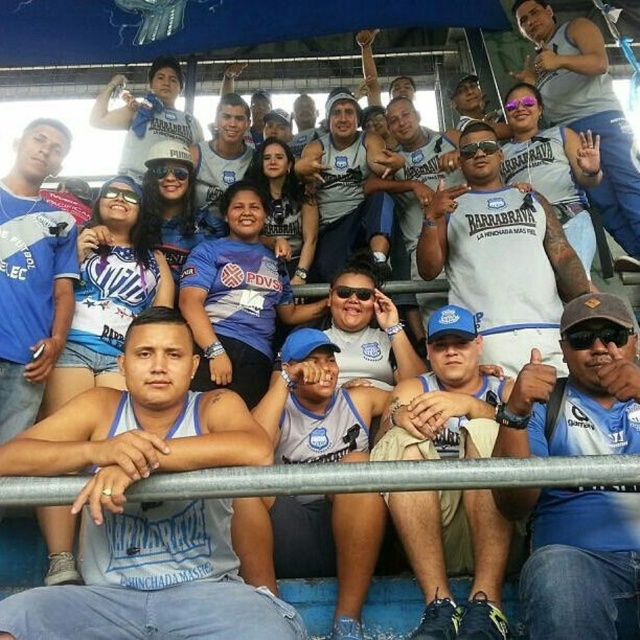
In the scene shown: Is blue jersey at center shorter than matte blue shirt at upper center?

Yes, blue jersey at center is shorter than matte blue shirt at upper center.

Based on the photo, which is more to the right, blue jersey at center or matte blue shirt at upper center?

Positioned to the right is blue jersey at center.

Is point (180, 579) farther from viewer compared to point (109, 120)?

No, it is in front of (109, 120).

You are a GUI agent. You are given a task and a screenshot of the screen. Output one action in this format:
    pyautogui.click(x=<x>, y=<y>)
    Task: Click on the blue jersey at center
    The height and width of the screenshot is (640, 640).
    Given the screenshot: What is the action you would take?
    pyautogui.click(x=147, y=506)

Which is behind, point (557, 362) or point (380, 163)?

Positioned behind is point (380, 163).

At what (x,y) coordinates should I click in order to perform the action: click on white matte t-shirt at center. Please return your answer as a coordinate pair (x, y). Looking at the image, I should click on [x=500, y=257].

Describe the element at coordinates (500, 257) in the screenshot. I see `white matte t-shirt at center` at that location.

Identify the location of white matte t-shirt at center. (500, 257).

In the scene shown: Which is below, white cotton t-shirt at upper center or white jersey at center?

white jersey at center is lower down.

The width and height of the screenshot is (640, 640). I want to click on white cotton t-shirt at upper center, so click(584, 108).

Between point (608, 81) and point (420, 198), which one is positioned behind?

The point (608, 81) is more distant.

Image resolution: width=640 pixels, height=640 pixels. Find the location of `white cotton t-shirt at upper center`. white cotton t-shirt at upper center is located at coordinates (584, 108).